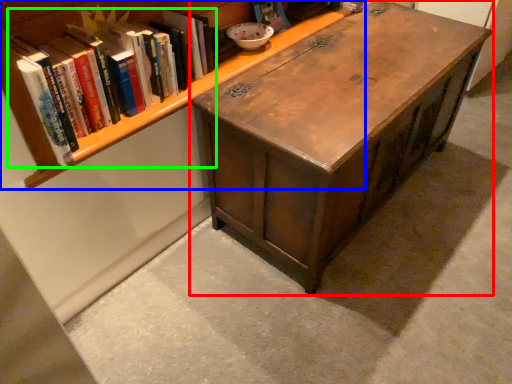
Question: Considering the real-world distances, which object is closest to table (highlighted by a red box)? bookcase (highlighted by a blue box) or book (highlighted by a green box).

Choices:
 (A) bookcase
 (B) book

Answer: (A)